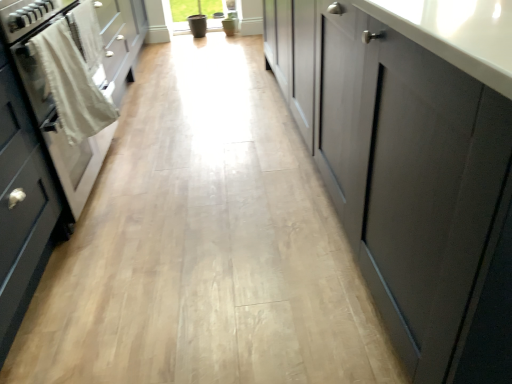
Question: Is white cotton towel at left located within matte gray cabinet at left, which is the 2th cabinetry in right-to-left order?

Choices:
 (A) no
 (B) yes

Answer: (A)

Question: Is matte gray cabinet at left, the 1th cabinetry when ordered from left to right, far from white cotton towel at left?

Choices:
 (A) yes
 (B) no

Answer: (B)

Question: Is white cotton towel at left at the back of matte gray cabinet at left, which is the 2th cabinetry in right-to-left order?

Choices:
 (A) yes
 (B) no

Answer: (B)

Question: Considering the relative sizes of matte gray cabinet at left, the 1th cabinetry when ordered from left to right, and white cotton towel at left in the image provided, is matte gray cabinet at left, the 1th cabinetry when ordered from left to right, shorter than white cotton towel at left?

Choices:
 (A) yes
 (B) no

Answer: (B)

Question: Does matte gray cabinet at left, which is the 2th cabinetry in right-to-left order, have a lesser width compared to white cotton towel at left?

Choices:
 (A) yes
 (B) no

Answer: (B)

Question: From the image's perspective, is white glossy oven at left above or below white cotton towel at left?

Choices:
 (A) above
 (B) below

Answer: (B)

Question: From a real-world perspective, relative to white cotton towel at left, is white glossy oven at left vertically above or below?

Choices:
 (A) below
 (B) above

Answer: (A)

Question: Considering the positions of white glossy oven at left and white cotton towel at left in the image, is white glossy oven at left wider or thinner than white cotton towel at left?

Choices:
 (A) thin
 (B) wide

Answer: (B)

Question: Does point (56, 150) appear closer or farther from the camera than point (67, 61)?

Choices:
 (A) closer
 (B) farther

Answer: (B)

Question: In terms of height, does white cotton towel at left look taller or shorter compared to white glossy oven at left?

Choices:
 (A) short
 (B) tall

Answer: (A)

Question: From a real-world perspective, is white cotton towel at left positioned above or below white glossy oven at left?

Choices:
 (A) below
 (B) above

Answer: (B)

Question: Considering their positions, is white cotton towel at left located in front of or behind white glossy oven at left?

Choices:
 (A) front
 (B) behind

Answer: (B)

Question: Considering the positions of point (51, 84) and point (102, 144), is point (51, 84) closer or farther from the camera than point (102, 144)?

Choices:
 (A) closer
 (B) farther

Answer: (A)

Question: From a real-world perspective, relative to matte gray cabinet at left, which is the 2th cabinetry in right-to-left order, is white glossy oven at left vertically above or below?

Choices:
 (A) above
 (B) below

Answer: (B)

Question: From their relative heights in the image, would you say white glossy oven at left is taller or shorter than matte gray cabinet at left, the 1th cabinetry when ordered from left to right?

Choices:
 (A) tall
 (B) short

Answer: (B)